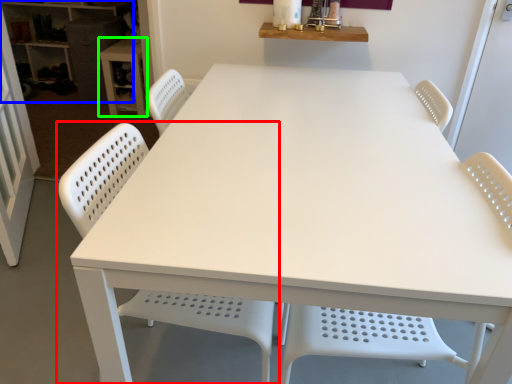
Question: Considering the real-world distances, which object is closest to chair (highlighted by a red box)? shelf (highlighted by a blue box) or table (highlighted by a green box).

Choices:
 (A) shelf
 (B) table

Answer: (B)